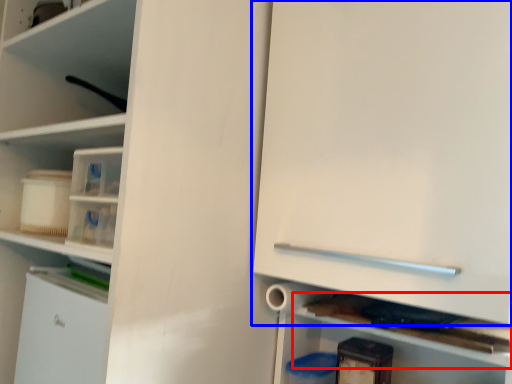
Question: Which object appears closest to the camera in this image, cabinet (highlighted by a red box) or cabinetry (highlighted by a blue box)?

Choices:
 (A) cabinet
 (B) cabinetry

Answer: (B)